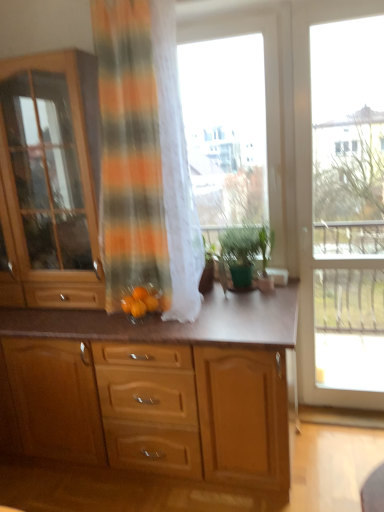
Question: Which direction should I rotate to face transparent glass window at center, which ranks as the first window in left-to-right order, — up or down?

Choices:
 (A) up
 (B) down

Answer: (A)

Question: Considering the relative positions of orange striped fabric at center and wooden cabinet at center, marked as the first cabinetry in a bottom-to-top arrangement, in the image provided, is orange striped fabric at center behind wooden cabinet at center, marked as the first cabinetry in a bottom-to-top arrangement,?

Choices:
 (A) yes
 (B) no

Answer: (B)

Question: Is orange striped fabric at center not inside wooden cabinet at center, which is the 2th cabinetry from top to bottom?

Choices:
 (A) yes
 (B) no

Answer: (A)

Question: Can you confirm if orange striped fabric at center is wider than wooden cabinet at center, which is the 2th cabinetry from top to bottom?

Choices:
 (A) yes
 (B) no

Answer: (B)

Question: Can wooden cabinet at center, marked as the first cabinetry in a bottom-to-top arrangement, be found inside orange striped fabric at center?

Choices:
 (A) no
 (B) yes

Answer: (A)

Question: Does orange striped fabric at center have a lesser height compared to wooden cabinet at center, marked as the first cabinetry in a bottom-to-top arrangement?

Choices:
 (A) yes
 (B) no

Answer: (B)

Question: Considering the relative sizes of orange striped fabric at center and wooden cabinet at center, which is the 2th cabinetry from top to bottom, in the image provided, is orange striped fabric at center smaller than wooden cabinet at center, which is the 2th cabinetry from top to bottom,?

Choices:
 (A) no
 (B) yes

Answer: (B)

Question: Is wooden cabinet at center, marked as the first cabinetry in a bottom-to-top arrangement, facing away from orange matte tangerine at center, which ranks as the second tangerine in right-to-left order?

Choices:
 (A) no
 (B) yes

Answer: (A)

Question: Could you tell me if wooden cabinet at center, which is the 2th cabinetry from top to bottom, is turned towards orange matte tangerine at center, which ranks as the second tangerine in right-to-left order?

Choices:
 (A) no
 (B) yes

Answer: (A)

Question: Can you confirm if wooden cabinet at center, marked as the first cabinetry in a bottom-to-top arrangement, is positioned to the right of orange matte tangerine at center, which appears as the first tangerine when viewed from the left?

Choices:
 (A) yes
 (B) no

Answer: (B)

Question: Can you confirm if wooden cabinet at center, marked as the first cabinetry in a bottom-to-top arrangement, is bigger than orange matte tangerine at center, which ranks as the second tangerine in right-to-left order?

Choices:
 (A) yes
 (B) no

Answer: (A)

Question: From the image's perspective, does wooden cabinet at center, marked as the first cabinetry in a bottom-to-top arrangement, appear lower than orange matte tangerine at center, which appears as the first tangerine when viewed from the left?

Choices:
 (A) no
 (B) yes

Answer: (B)

Question: Considering the relative sizes of wooden cabinet at center, which is the 2th cabinetry from top to bottom, and orange matte tangerine at center, which ranks as the second tangerine in right-to-left order, in the image provided, is wooden cabinet at center, which is the 2th cabinetry from top to bottom, taller than orange matte tangerine at center, which ranks as the second tangerine in right-to-left order,?

Choices:
 (A) yes
 (B) no

Answer: (A)

Question: Is transparent glass door at right, which ranks as the first window in right-to-left order, thinner than green matte plant at center?

Choices:
 (A) no
 (B) yes

Answer: (B)